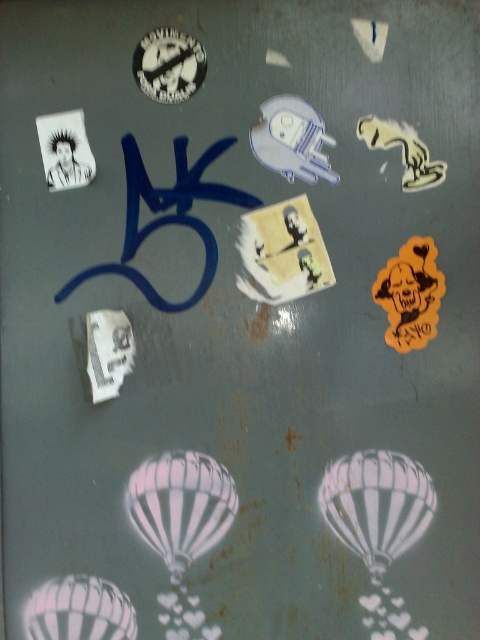
Is white striped balloon at center bigger than white striped balloon at lower left?

Yes.

Does white striped balloon at center have a lesser width compared to white striped balloon at lower left?

No.

Locate an element on the screen. white striped balloon at center is located at coordinates (180, 506).

Does white striped balloon at lower center have a smaller size compared to white striped balloon at center?

No.

Is white striped balloon at lower center above white striped balloon at center?

Correct, white striped balloon at lower center is located above white striped balloon at center.

Where is `white striped balloon at lower center`? The height and width of the screenshot is (640, 480). white striped balloon at lower center is located at coordinates (376, 504).

Locate an element on the screen. white striped balloon at lower center is located at coordinates (376, 504).

What do you see at coordinates (376, 504) in the screenshot? I see `white striped balloon at lower center` at bounding box center [376, 504].

Consider the image. Between white striped balloon at lower center and white striped balloon at lower left, which one has less height?

With less height is white striped balloon at lower left.

Does point (347, 493) come farther from viewer compared to point (41, 637)?

Yes, it is behind point (41, 637).

Image resolution: width=480 pixels, height=640 pixels. I want to click on white striped balloon at lower center, so click(x=376, y=504).